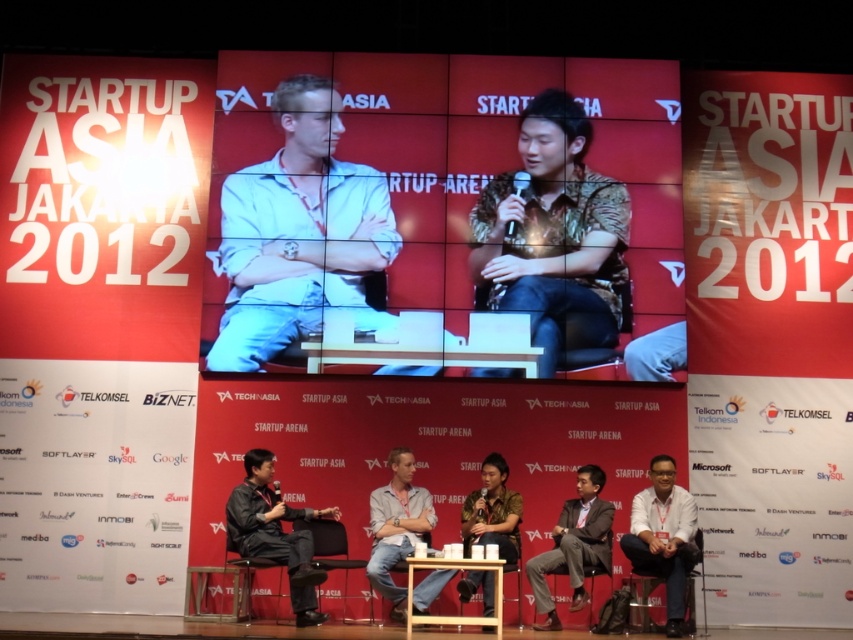
Question: Is brown textured shirt at center closer to the viewer compared to denim jeans at center?

Choices:
 (A) yes
 (B) no

Answer: (B)

Question: Among these objects, which one is nearest to the camera?

Choices:
 (A) wooden at center
 (B) white matte shirt at lower right
 (C) light blue denim jeans at center
 (D) black fabric chair at lower left

Answer: (B)

Question: Which of these objects is positioned closest to the black fabric chair at lower left?

Choices:
 (A) matte black chair at lower right
 (B) black leather chair at lower left
 (C) wooden at center
 (D) white matte shirt at lower right

Answer: (B)

Question: Can you confirm if light blue denim jeans at center is positioned above denim jeans at center?

Choices:
 (A) no
 (B) yes

Answer: (B)

Question: Which point is closer to the camera?

Choices:
 (A) light blue denim jeans at center
 (B) white matte shirt at lower right
 (C) wooden at center

Answer: (B)

Question: Is black fabric chair at lower left wider than wooden at center?

Choices:
 (A) no
 (B) yes

Answer: (B)